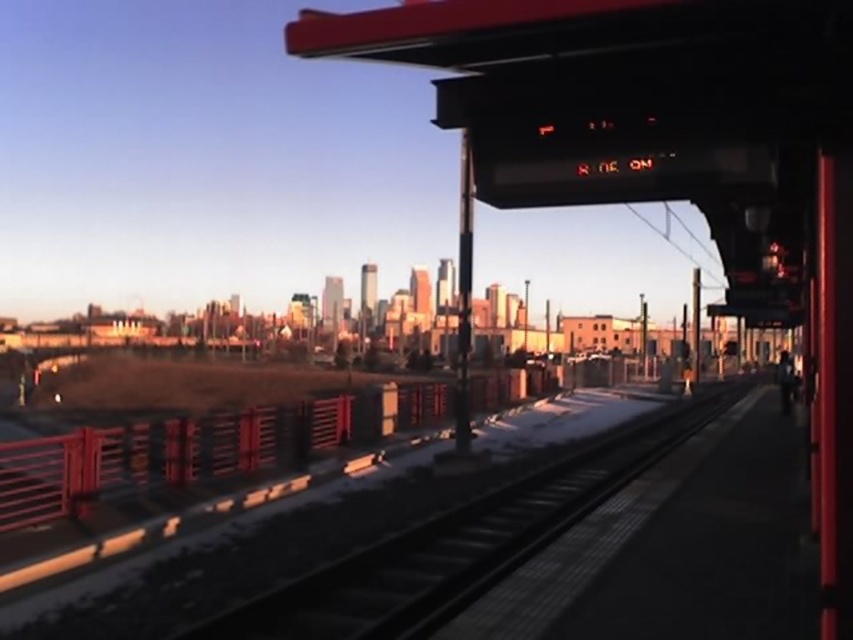
You are a maintenance worker checking the train station platform. You need to identify which object is thinner between the metallic gray train track at center and the metallic red rail at lower left. Which one should you report?

The metallic gray train track at center is thinner than the metallic red rail at lower left, so you should report the metallic gray train track at center as the thinner one.

You are standing at the train station platform and want to walk towards the city skyline. Which point, point (596, 500) or point (305, 436), is closer to the direction you are facing?

Point (596, 500) is in front of point (305, 436), so it is closer to the direction you are facing towards the city skyline.

You are a maintenance worker inspecting the platform. You notice the metallic gray train track at center and the metallic red rail at lower left. Which object is located above the other?

The metallic gray train track at center is positioned over the metallic red rail at lower left.